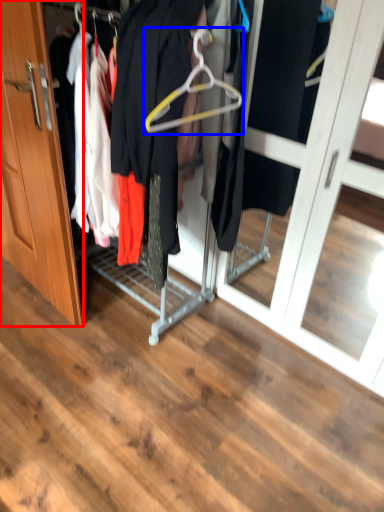
Question: Which point is closer to the camera, door (highlighted by a red box) or hanger (highlighted by a blue box)?

Choices:
 (A) door
 (B) hanger

Answer: (B)